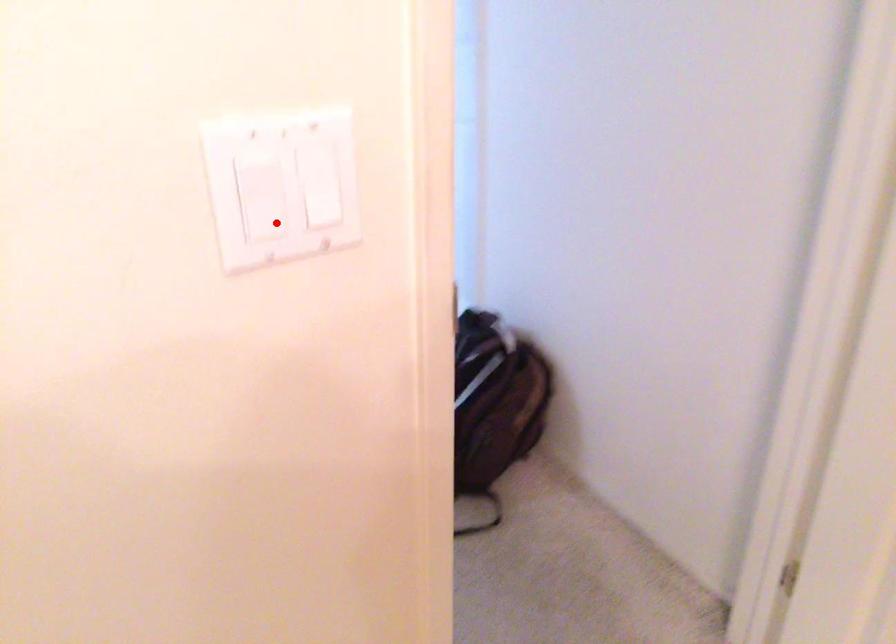
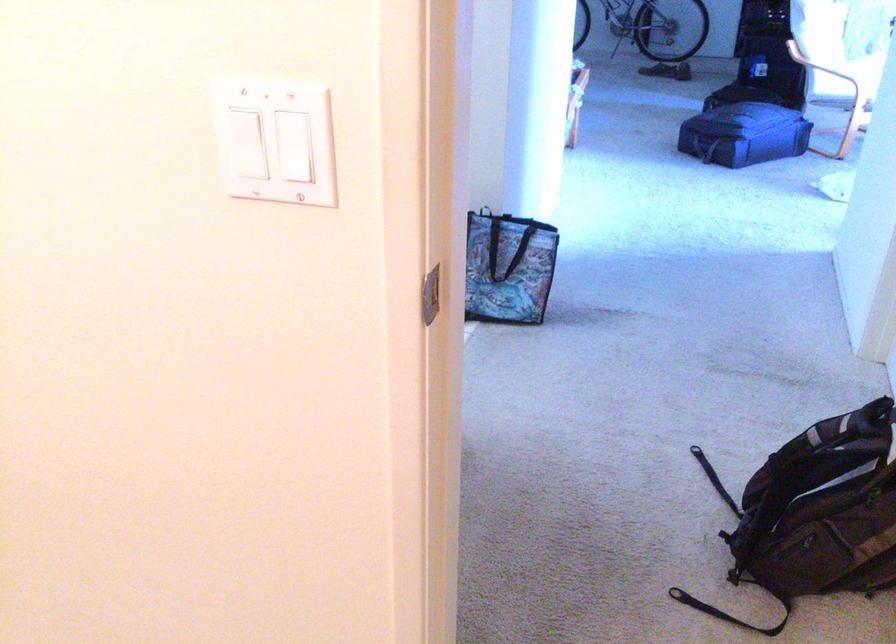
Question: I am providing you with two images of the same scene from different viewpoints. Given a red point in image1, look at the same physical point in image2. Is it:

Choices:
 (A) Closer to the viewpoint
 (B) Farther from the viewpoint

Answer: (B)